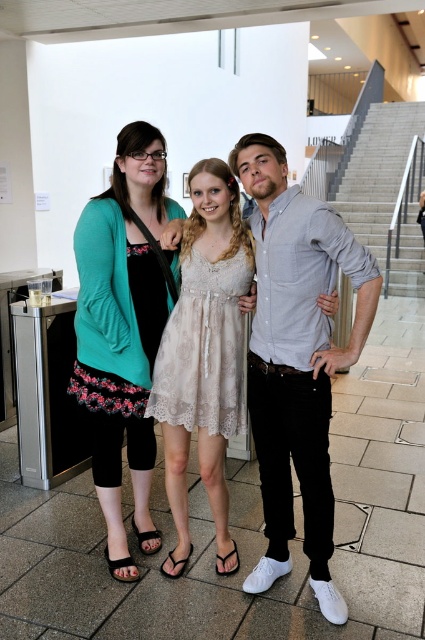
Who is shorter, light gray cotton shirt at center or teal fabric cardigan at center?

With less height is light gray cotton shirt at center.

Does point (274, 467) lie behind point (144, 170)?

Yes, it is behind point (144, 170).

Between point (373, 264) and point (170, 282), which one is positioned behind?

The point (170, 282) is behind.

Locate an element on the screen. light gray cotton shirt at center is located at coordinates (297, 358).

How distant is light beige lace dress at center from teal fabric cardigan at center?

light beige lace dress at center is 20.43 inches from teal fabric cardigan at center.

Is light beige lace dress at center below teal fabric cardigan at center?

Indeed, light beige lace dress at center is positioned under teal fabric cardigan at center.

Where is `light beige lace dress at center`? light beige lace dress at center is located at coordinates (297, 356).

Is the position of light beige lace dress at center less distant than that of light gray cotton shirt at center?

That is True.

The image size is (425, 640). Describe the element at coordinates (297, 356) in the screenshot. I see `light beige lace dress at center` at that location.

Where is `light beige lace dress at center`? This screenshot has height=640, width=425. light beige lace dress at center is located at coordinates (297, 356).